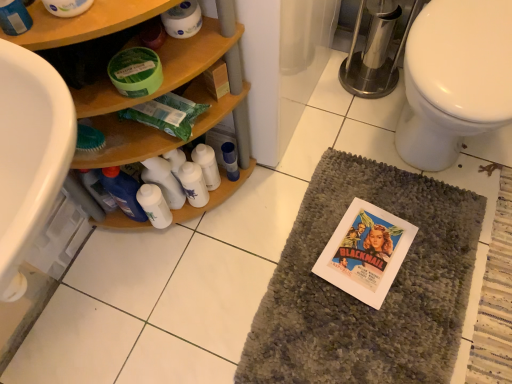
At what (x,y) coordinates should I click in order to perform the action: click on free location in front of white plastic bottles at center, positioned as the 1th bottle in left-to-right order. Please return your answer as a coordinate pair (x, y). Looking at the image, I should click on (218, 237).